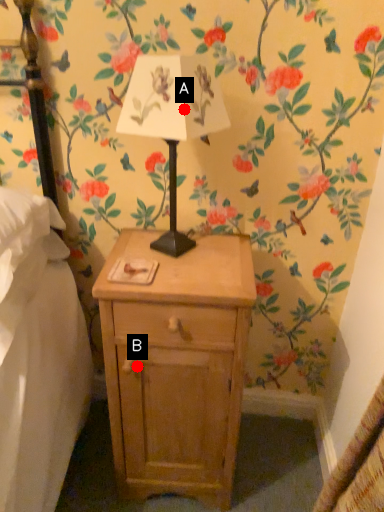
Question: Two points are circled on the image, labeled by A and B beside each circle. Which point is closer to the camera?

Choices:
 (A) A is closer
 (B) B is closer

Answer: (A)